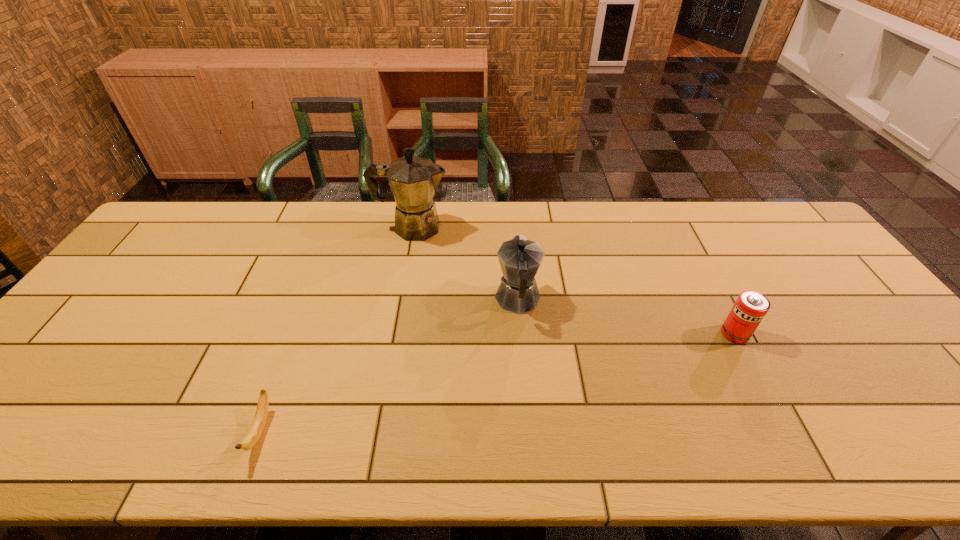
At what (x,y) coordinates should I click in order to perform the action: click on the farthest object. Please return your answer as a coordinate pair (x, y). Looking at the image, I should click on (413, 180).

You are a GUI agent. You are given a task and a screenshot of the screen. Output one action in this format:
    pyautogui.click(x=<x>, y=<y>)
    Task: Click on the tallest object
    The image size is (960, 540).
    Given the screenshot: What is the action you would take?
    pyautogui.click(x=413, y=180)

Find the location of `the nearer coffeepot`. the nearer coffeepot is located at coordinates (519, 258).

Locate an element on the screen. the third shortest object is located at coordinates (519, 258).

I want to click on can, so click(x=748, y=311).

Locate an element on the screen. The width and height of the screenshot is (960, 540). the rightmost object is located at coordinates (748, 311).

Identify the location of the shortest object. This screenshot has width=960, height=540. (258, 424).

The image size is (960, 540). What are the coordinates of `banana` in the screenshot? It's located at (258, 424).

I want to click on free region located 0.150m on the pouring side of the farthest object, so click(494, 227).

I want to click on free space located 0.260m at the spout of the second tallest object, so click(512, 224).